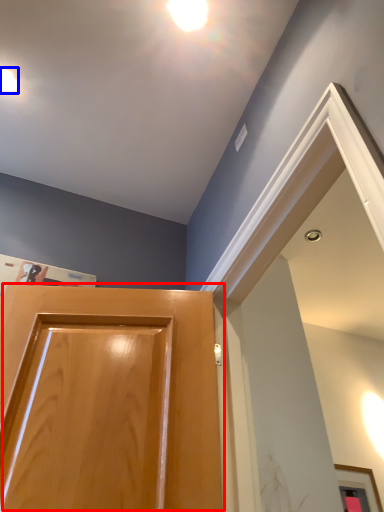
Question: Which point is further to the camera, door (highlighted by a red box) or droplight (highlighted by a blue box)?

Choices:
 (A) door
 (B) droplight

Answer: (B)